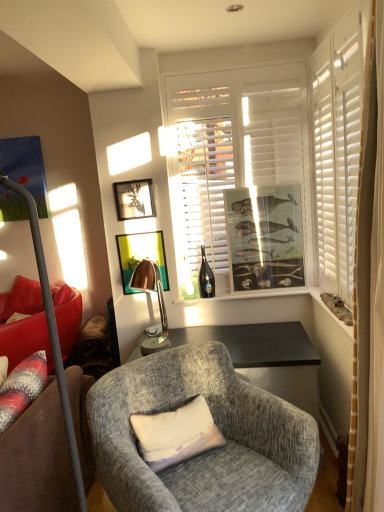
Question: Is pastel fabric pillow at center taller or shorter than matte wooden picture frame at center, which ranks as the third picture frame in left-to-right order?

Choices:
 (A) tall
 (B) short

Answer: (B)

Question: Is point (206, 422) positioned closer to the camera than point (233, 226)?

Choices:
 (A) farther
 (B) closer

Answer: (B)

Question: Estimate the real-world distances between objects in this image. Which object is closer to the matte glass window sill at center, which ranks as the first window sill in back-to-front order?

Choices:
 (A) textured gray armchair at center
 (B) white textured stone at right, acting as the 1th window sill starting from the right
 (C) translucent glass bottle at center
 (D) pastel fabric pillow at center
 (E) white wood window at center

Answer: (C)

Question: Which is farther from the textured gray armchair at center?

Choices:
 (A) red fabric couch at left
 (B) matte wooden picture frame at center, which ranks as the third picture frame in left-to-right order
 (C) metallic gold picture frame at center, marked as the second picture frame in a right-to-left arrangement
 (D) pastel fabric pillow at center
 (E) white textured stone at right, the second window sill when ordered from back to front

Answer: (B)